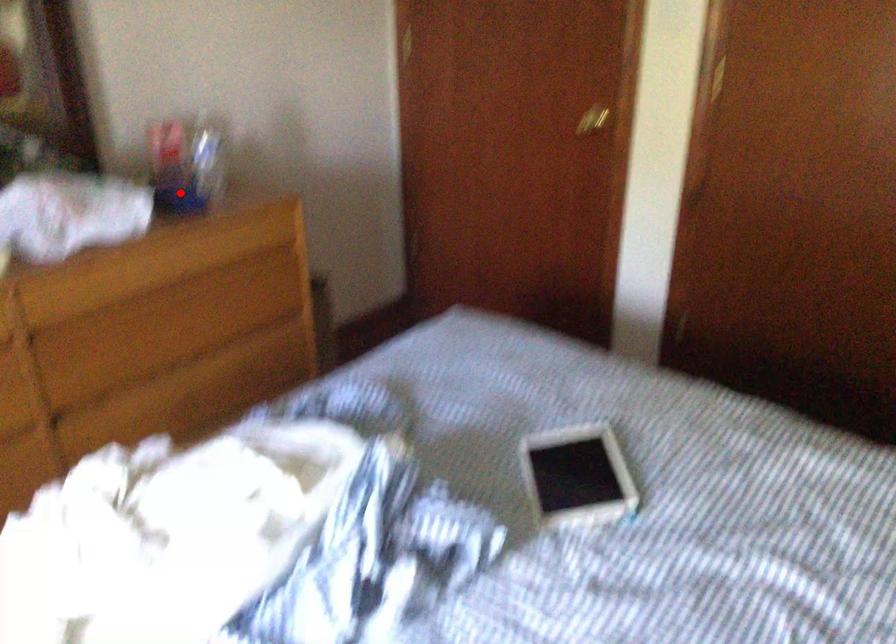
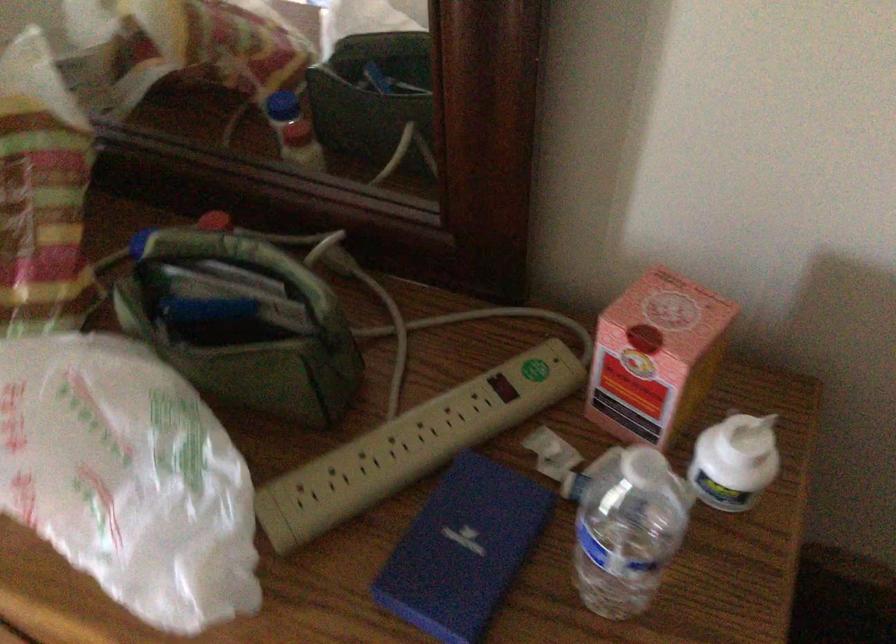
Question: I am providing you with two images of the same scene from different viewpoints. In image1, a red point is highlighted. Considering the same 3D point in image2, which of the following is correct?

Choices:
 (A) It is closer
 (B) It is farther

Answer: (A)